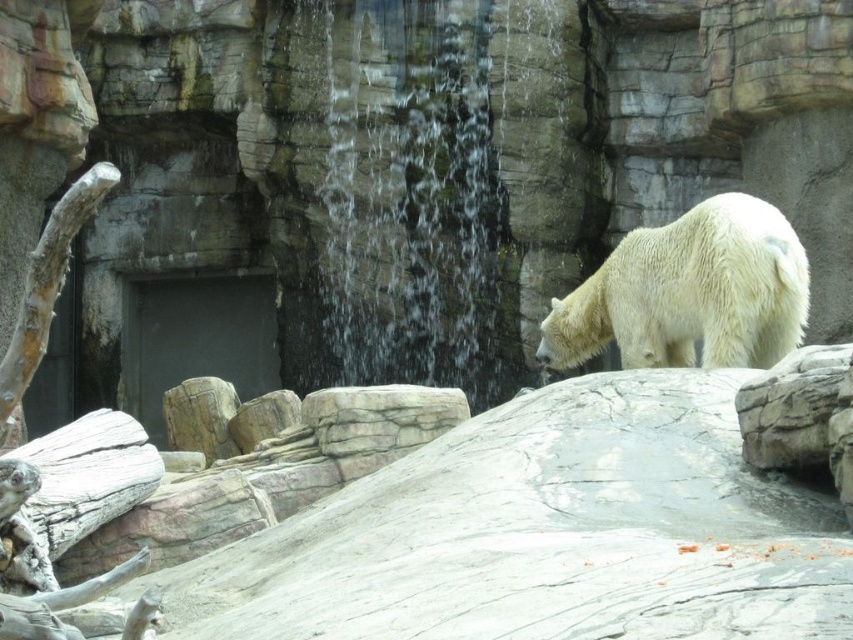
Question: Is clear water at center wider than white fluffy bear at right?

Choices:
 (A) no
 (B) yes

Answer: (B)

Question: Which point is closer to the camera?

Choices:
 (A) clear water at center
 (B) white fluffy bear at right

Answer: (B)

Question: Which of the following is the farthest from the observer?

Choices:
 (A) (402, 51)
 (B) (575, 300)

Answer: (A)

Question: Is clear water at center wider than white fluffy bear at right?

Choices:
 (A) yes
 (B) no

Answer: (A)

Question: Where is clear water at center located in relation to white fluffy bear at right in the image?

Choices:
 (A) right
 (B) left

Answer: (B)